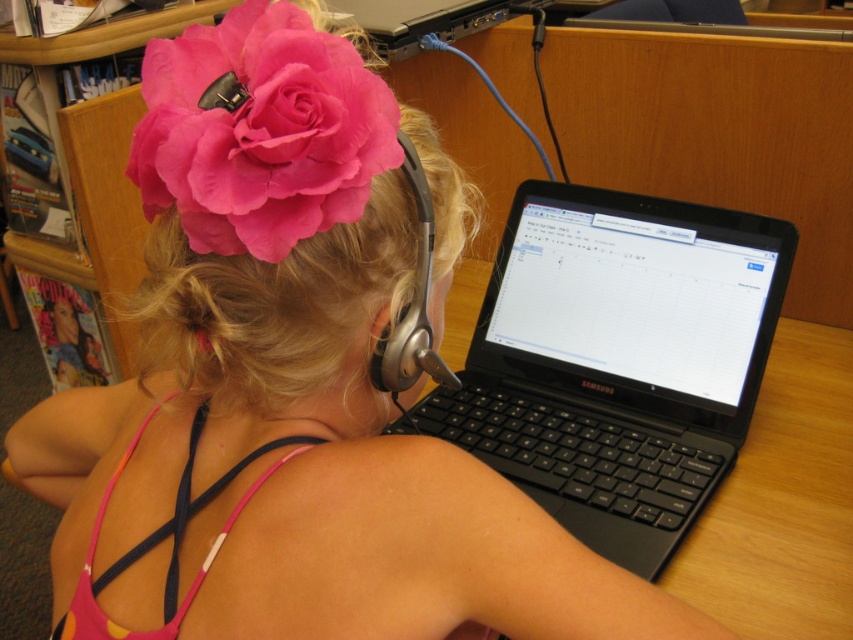
Is pink fabric flower at upper center wider than pink fabric bikini top at back?

Yes, pink fabric flower at upper center is wider than pink fabric bikini top at back.

Does point (308, 368) come farther from viewer compared to point (103, 630)?

Yes, point (308, 368) is farther from viewer.

At what (x,y) coordinates should I click in order to perform the action: click on pink fabric flower at upper center. Please return your answer as a coordinate pair (x, y). Image resolution: width=853 pixels, height=640 pixels. Looking at the image, I should click on (274, 301).

Is matte pink fabric flower at upper left wider than satin silver earphone at upper center?

Yes, matte pink fabric flower at upper left is wider than satin silver earphone at upper center.

Who is more distant from viewer, (241, 145) or (418, 184)?

Positioned behind is point (418, 184).

Does point (271, 164) lie behind point (422, 172)?

No, (271, 164) is closer to viewer.

In order to click on matte pink fabric flower at upper left in this screenshot , I will do `click(259, 131)`.

Can you confirm if matte pink fabric flower at upper left is positioned to the left of pink fabric bikini top at back?

Incorrect, matte pink fabric flower at upper left is not on the left side of pink fabric bikini top at back.

Does matte pink fabric flower at upper left have a lesser width compared to pink fabric bikini top at back?

Yes, matte pink fabric flower at upper left is thinner than pink fabric bikini top at back.

Which is behind, point (152, 148) or point (173, 573)?

Point (173, 573)

Where is `matte pink fabric flower at upper left`? This screenshot has height=640, width=853. matte pink fabric flower at upper left is located at coordinates (259, 131).